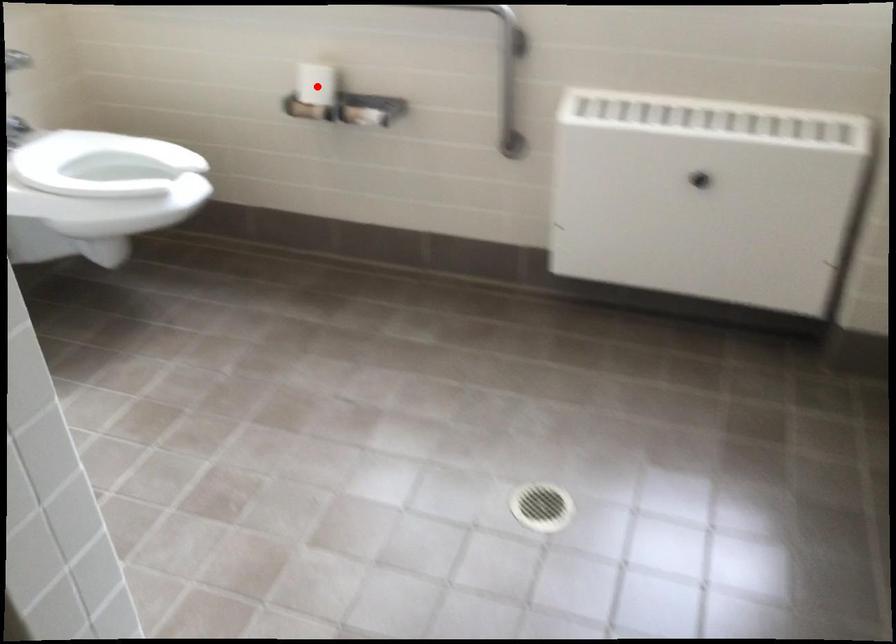
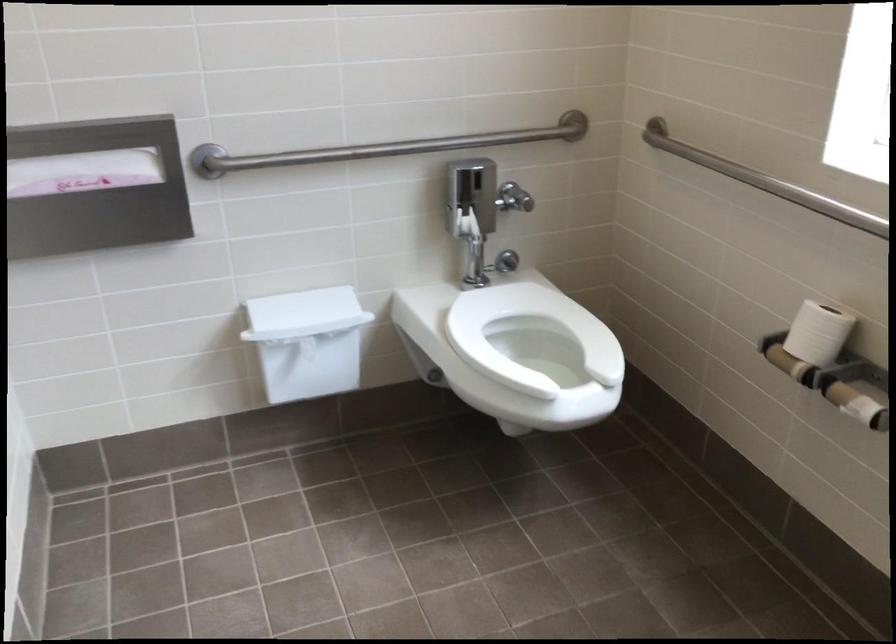
Find the pixel in the second image that matches the highlighted location in the first image.

(817, 333)